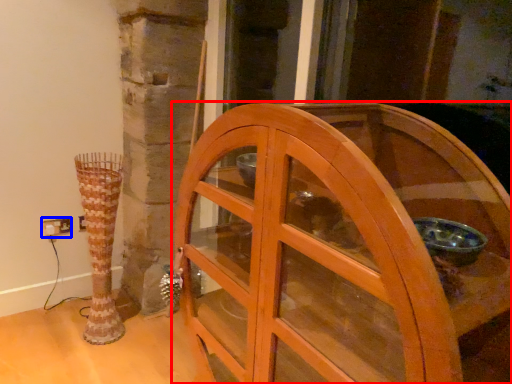
Question: Which object appears closest to the camera in this image, furniture (highlighted by a red box) or electric outlet (highlighted by a blue box)?

Choices:
 (A) furniture
 (B) electric outlet

Answer: (A)